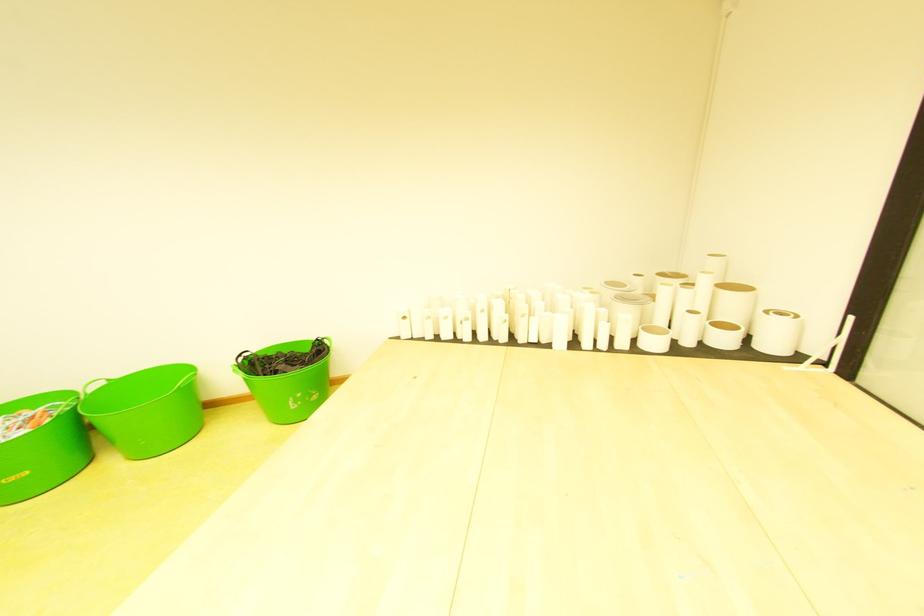
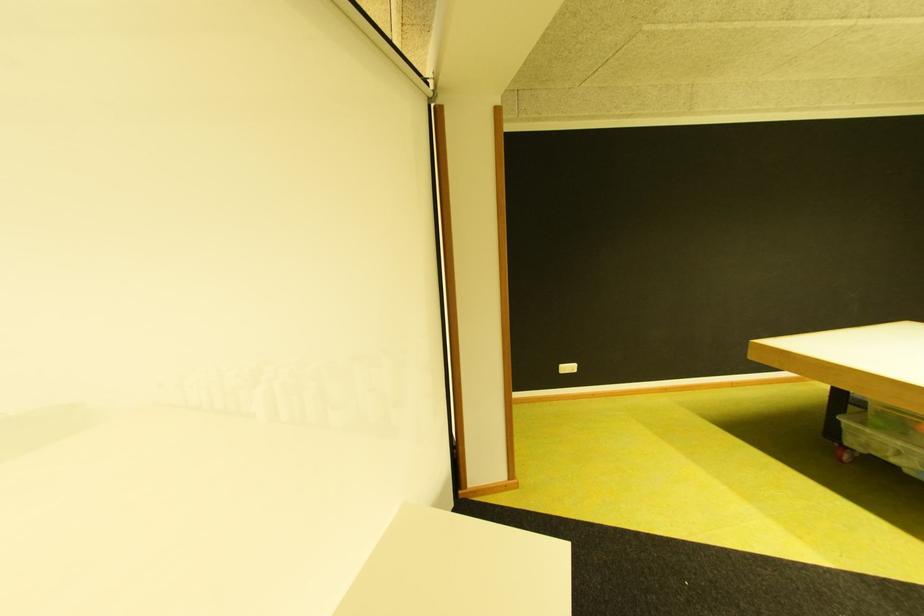
Question: What movement of the cameraman would produce the second image?

Choices:
 (A) Left
 (B) Right
 (C) Forward
 (D) Backward

Answer: (B)